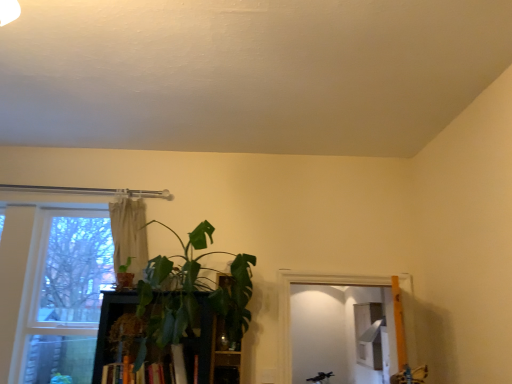
Question: Does clear glass window at left have a greater width compared to beige fabric curtain at upper center?

Choices:
 (A) no
 (B) yes

Answer: (B)

Question: Is clear glass window at left touching beige fabric curtain at upper center?

Choices:
 (A) yes
 (B) no

Answer: (B)

Question: Considering the relative positions of clear glass window at left and beige fabric curtain at upper center in the image provided, is clear glass window at left in front of beige fabric curtain at upper center?

Choices:
 (A) no
 (B) yes

Answer: (B)

Question: Is clear glass window at left behind beige fabric curtain at upper center?

Choices:
 (A) yes
 (B) no

Answer: (B)

Question: Does clear glass window at left have a lesser height compared to beige fabric curtain at upper center?

Choices:
 (A) yes
 (B) no

Answer: (B)

Question: From a real-world perspective, is clear glass window at left positioned over beige fabric curtain at upper center based on gravity?

Choices:
 (A) no
 (B) yes

Answer: (A)

Question: Considering the relative sizes of beige fabric curtain at upper center and green leafy plant at center, which is the 2th houseplant from left to right, in the image provided, is beige fabric curtain at upper center thinner than green leafy plant at center, which is the 2th houseplant from left to right,?

Choices:
 (A) yes
 (B) no

Answer: (A)

Question: Is beige fabric curtain at upper center aimed at green leafy plant at center, which is counted as the first houseplant, starting from the right?

Choices:
 (A) yes
 (B) no

Answer: (B)

Question: Does beige fabric curtain at upper center have a greater height compared to green leafy plant at center, which is counted as the first houseplant, starting from the right?

Choices:
 (A) no
 (B) yes

Answer: (A)

Question: Is the depth of beige fabric curtain at upper center less than that of green leafy plant at center, which is counted as the first houseplant, starting from the right?

Choices:
 (A) yes
 (B) no

Answer: (B)

Question: Is beige fabric curtain at upper center not inside green leafy plant at center, which is the 2th houseplant from left to right?

Choices:
 (A) no
 (B) yes

Answer: (B)

Question: From the image's perspective, is beige fabric curtain at upper center under green leafy plant at center, which is counted as the first houseplant, starting from the right?

Choices:
 (A) yes
 (B) no

Answer: (B)

Question: Is green leafy plant at center, which is counted as the first houseplant, starting from the right, at the right side of beige fabric curtain at upper center?

Choices:
 (A) no
 (B) yes

Answer: (B)